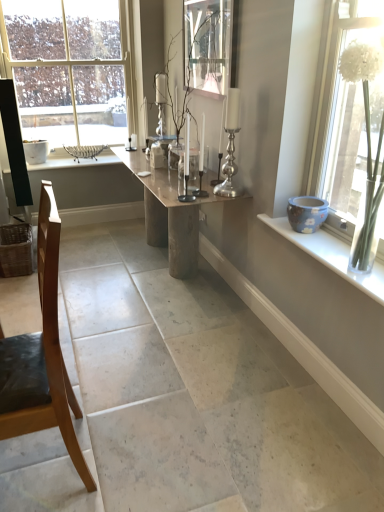
Measure the distance between point (340, 260) and camera.

The distance of point (340, 260) from camera is 6.51 feet.

This screenshot has width=384, height=512. What do you see at coordinates (169, 213) in the screenshot?
I see `natural wood table at center` at bounding box center [169, 213].

Describe the element at coordinates (230, 145) in the screenshot. Image resolution: width=384 pixels, height=512 pixels. I see `silver metallic candle holder at center, the first candle holder from the right` at that location.

At what (x,y) coordinates should I click in order to perform the action: click on clear glass picture frame at upper center. Please return your answer as a coordinate pair (x, y). The height and width of the screenshot is (512, 384). Looking at the image, I should click on (209, 45).

This screenshot has height=512, width=384. Describe the element at coordinates (327, 90) in the screenshot. I see `clear glass vase at right, which ranks as the first window in front-to-back order` at that location.

Locate an element on the screen. blue ceramic pot at right is located at coordinates (331, 256).

Considering the sizes of blue ceramic pot at right and silver metallic candle holder at center, the first candle holder from the right, in the image, is blue ceramic pot at right taller or shorter than silver metallic candle holder at center, the first candle holder from the right,?

Clearly, blue ceramic pot at right is shorter compared to silver metallic candle holder at center, the first candle holder from the right.

From the image's perspective, is blue ceramic pot at right positioned above or below silver metallic candle holder at center, the first candle holder from the right?

Clearly, from the image's perspective, blue ceramic pot at right is below silver metallic candle holder at center, the first candle holder from the right.

Which object is positioned more to the left, blue ceramic pot at right or silver metallic candle holder at center, the 2th candle holder viewed from the left?

silver metallic candle holder at center, the 2th candle holder viewed from the left.

From the image's perspective, which candle holder is the 2nd one above the blue ceramic pot at right? Please provide its 2D coordinates.

[(230, 145)]

Which is more to the left, natural wood table at center or blue ceramic pot at right?

natural wood table at center is more to the left.

The height and width of the screenshot is (512, 384). What are the coordinates of `table behind the blue ceramic pot at right` in the screenshot? It's located at 169,213.

Does natural wood table at center have a greater height compared to blue ceramic pot at right?

Yes, natural wood table at center is taller than blue ceramic pot at right.

Is blue ceramic pot at right far from clear glass candle holder at center, which ranks as the 1th candle holder in left-to-right order?

blue ceramic pot at right is near clear glass candle holder at center, which ranks as the 1th candle holder in left-to-right order, not far away.

How many degrees apart are the facing directions of blue ceramic pot at right and clear glass candle holder at center, the second candle holder viewed from the right?

They differ by 0.544 degrees in their facing directions.

Considering the sizes of objects blue ceramic pot at right and clear glass candle holder at center, which ranks as the 1th candle holder in left-to-right order, in the image provided, who is bigger, blue ceramic pot at right or clear glass candle holder at center, which ranks as the 1th candle holder in left-to-right order,?

blue ceramic pot at right.

Which object is positioned more to the left, blue ceramic pot at right or clear glass candle holder at center, which ranks as the 1th candle holder in left-to-right order?

clear glass candle holder at center, which ranks as the 1th candle holder in left-to-right order.

Is natural wood table at center not within clear glass picture frame at upper center?

Absolutely, natural wood table at center is external to clear glass picture frame at upper center.

Does natural wood table at center touch clear glass picture frame at upper center?

No, natural wood table at center is not next to clear glass picture frame at upper center.

From the image's perspective, between natural wood table at center and clear glass picture frame at upper center, which one is located above?

clear glass picture frame at upper center is shown above in the image.

Is silver metallic candle holder at center, the 2th candle holder viewed from the left, placed right next to clear glass candle holder at center, which ranks as the 1th candle holder in left-to-right order?

No, silver metallic candle holder at center, the 2th candle holder viewed from the left, is not with clear glass candle holder at center, which ranks as the 1th candle holder in left-to-right order.

Is silver metallic candle holder at center, the first candle holder from the right, aimed at clear glass candle holder at center, which ranks as the 1th candle holder in left-to-right order?

Yes, silver metallic candle holder at center, the first candle holder from the right, faces towards clear glass candle holder at center, which ranks as the 1th candle holder in left-to-right order.

Visually, is silver metallic candle holder at center, the 2th candle holder viewed from the left, positioned to the left or to the right of clear glass candle holder at center, which ranks as the 1th candle holder in left-to-right order?

silver metallic candle holder at center, the 2th candle holder viewed from the left, is positioned on clear glass candle holder at center, which ranks as the 1th candle holder in left-to-right order,'s right side.

In terms of height, does silver metallic candle holder at center, the 2th candle holder viewed from the left, look taller or shorter compared to clear glass candle holder at center, which ranks as the 1th candle holder in left-to-right order?

In the image, silver metallic candle holder at center, the 2th candle holder viewed from the left, appears to be taller than clear glass candle holder at center, which ranks as the 1th candle holder in left-to-right order.

Is clear glass candle holder at center, the second candle holder viewed from the right, taller or shorter than clear glass window at upper left, which is counted as the 1th window, starting from the left?

clear glass candle holder at center, the second candle holder viewed from the right, is shorter than clear glass window at upper left, which is counted as the 1th window, starting from the left.

Can you confirm if clear glass candle holder at center, the second candle holder viewed from the right, is positioned to the right of clear glass window at upper left, marked as the first window in a top-to-bottom arrangement?

Yes, clear glass candle holder at center, the second candle holder viewed from the right, is to the right of clear glass window at upper left, marked as the first window in a top-to-bottom arrangement.

Is clear glass candle holder at center, which ranks as the 1th candle holder in left-to-right order, wider than clear glass window at upper left, marked as the first window in a top-to-bottom arrangement?

In fact, clear glass candle holder at center, which ranks as the 1th candle holder in left-to-right order, might be narrower than clear glass window at upper left, marked as the first window in a top-to-bottom arrangement.

How different are the orientations of clear glass candle holder at center, which ranks as the 1th candle holder in left-to-right order, and clear glass window at upper left, which is counted as the 1th window, starting from the left, in degrees?

90.6 degrees.

Visually, is natural wood table at center positioned to the left or to the right of silver metallic candle holder at center, the 2th candle holder viewed from the left?

Clearly, natural wood table at center is on the left of silver metallic candle holder at center, the 2th candle holder viewed from the left, in the image.

Is natural wood table at center facing towards silver metallic candle holder at center, the first candle holder from the right?

No, natural wood table at center is not aimed at silver metallic candle holder at center, the first candle holder from the right.

Considering the points (133, 162) and (226, 163), which point is behind, point (133, 162) or point (226, 163)?

Point (133, 162)

Is natural wood table at center outside of silver metallic candle holder at center, the first candle holder from the right?

natural wood table at center lies outside silver metallic candle holder at center, the first candle holder from the right,'s area.

Locate an element on the screen. The width and height of the screenshot is (384, 512). shelf located on the right of silver metallic candle holder at center, the first candle holder from the right is located at coordinates (331, 256).

The height and width of the screenshot is (512, 384). Find the location of `shelf above the natural wood table at center (from a real-world perspective)`. shelf above the natural wood table at center (from a real-world perspective) is located at coordinates (331, 256).

Based on the photo, which object lies further to the anchor point light wood chair at left, silver metallic candle holder at center, the 2th candle holder viewed from the left, or clear glass vase at right, acting as the 1th window starting from the right?

Based on the image, clear glass vase at right, acting as the 1th window starting from the right, appears to be further to light wood chair at left.

Looking at the image, which one is located closer to natural wood table at center, clear glass candle holder at center, the second candle holder viewed from the right, or clear glass window at upper left, the 2th window from the bottom?

Based on the image, clear glass candle holder at center, the second candle holder viewed from the right, appears to be nearer to natural wood table at center.

From the image, which object appears to be nearer to clear glass vase at right, which ranks as the first window in bottom-to-top order, clear glass picture frame at upper center or clear glass candle holder at center, the second candle holder viewed from the right?

clear glass candle holder at center, the second candle holder viewed from the right, lies closer to clear glass vase at right, which ranks as the first window in bottom-to-top order, than the other object.

From the image, which object appears to be nearer to clear glass candle holder at center, which ranks as the 1th candle holder in left-to-right order, blue ceramic pot at right or clear glass picture frame at upper center?

clear glass picture frame at upper center is closer to clear glass candle holder at center, which ranks as the 1th candle holder in left-to-right order.

Based on their spatial positions, is natural wood table at center or clear glass picture frame at upper center further from clear glass candle holder at center, the second candle holder viewed from the right?

The object further to clear glass candle holder at center, the second candle holder viewed from the right, is clear glass picture frame at upper center.

Considering their positions, is silver metallic candle holder at center, the 2th candle holder viewed from the left, positioned closer to natural wood table at center than clear glass window at upper left, the 2th window from the bottom?

silver metallic candle holder at center, the 2th candle holder viewed from the left.

In the scene shown: Looking at the image, which one is located further to clear glass picture frame at upper center, blue ceramic pot at right or natural wood table at center?

blue ceramic pot at right is further to clear glass picture frame at upper center.

When comparing their distances from blue ceramic pot at right, does silver metallic candle holder at center, the 2th candle holder viewed from the left, or light wood chair at left seem closer?

The object closer to blue ceramic pot at right is silver metallic candle holder at center, the 2th candle holder viewed from the left.

At what (x,y) coordinates should I click in order to perform the action: click on shelf between clear glass vase at right, which is the second window in top-to-bottom order, and silver metallic candle holder at center, the first candle holder from the right, from front to back. Please return your answer as a coordinate pair (x, y). The width and height of the screenshot is (384, 512). Looking at the image, I should click on (331, 256).

At what (x,y) coordinates should I click in order to perform the action: click on shelf between light wood chair at left and clear glass window at upper left, the 2th window from the bottom, along the z-axis. Please return your answer as a coordinate pair (x, y). Looking at the image, I should click on (331, 256).

I want to click on candle holder between clear glass window at upper left, the 2th window from the bottom, and clear glass picture frame at upper center, in the horizontal direction, so click(201, 163).

Where is `candle holder between light wood chair at left and clear glass candle holder at center, which ranks as the 1th candle holder in left-to-right order, from front to back`? The height and width of the screenshot is (512, 384). candle holder between light wood chair at left and clear glass candle holder at center, which ranks as the 1th candle holder in left-to-right order, from front to back is located at coordinates (230, 145).